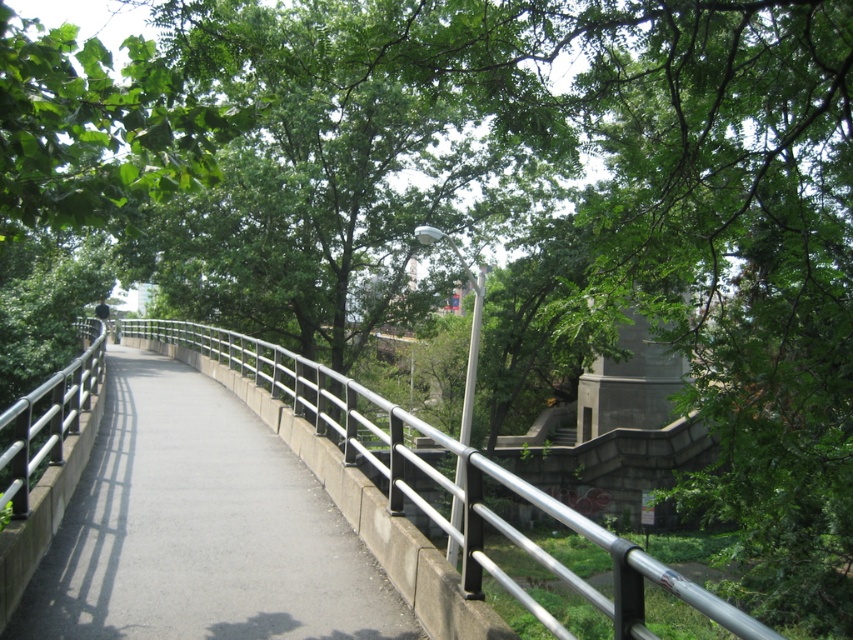
In the scene shown: Is gray concrete path at center to the left of silver metallic rail at center from the viewer's perspective?

In fact, gray concrete path at center is to the right of silver metallic rail at center.

Can you confirm if gray concrete path at center is shorter than silver metallic rail at center?

Correct, gray concrete path at center is not as tall as silver metallic rail at center.

Who is more forward, (146,390) or (744,620)?

Point (744,620) is more forward.

Identify the location of gray concrete path at center. Image resolution: width=853 pixels, height=640 pixels. (199, 529).